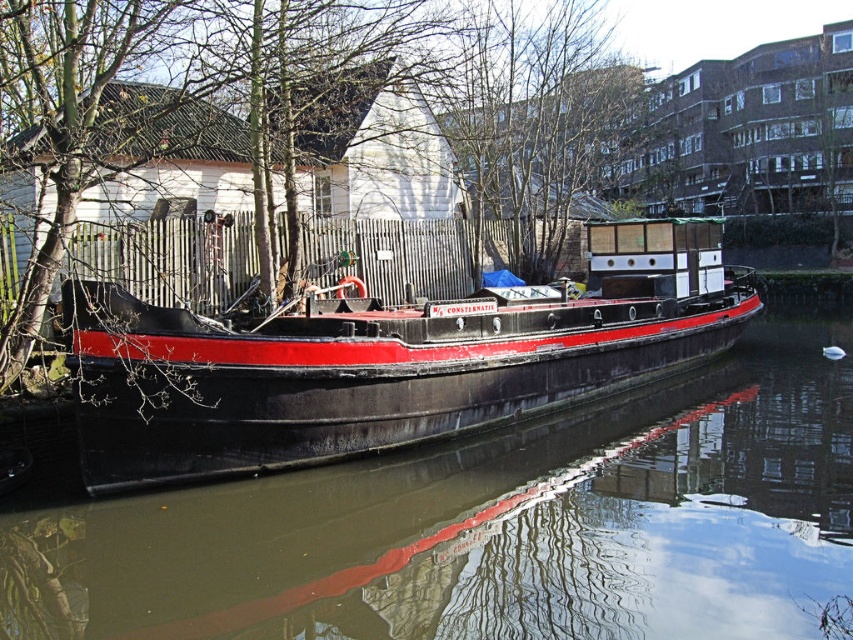
Question: Can you confirm if black rubber boat at center is positioned to the left of black matte boat at center?

Choices:
 (A) yes
 (B) no

Answer: (B)

Question: Which point is closer to the camera?

Choices:
 (A) black rubber boat at center
 (B) black matte boat at center

Answer: (A)

Question: Where is black rubber boat at center located in relation to black matte boat at center in the image?

Choices:
 (A) right
 (B) left

Answer: (A)

Question: Is black rubber boat at center above black matte boat at center?

Choices:
 (A) no
 (B) yes

Answer: (A)